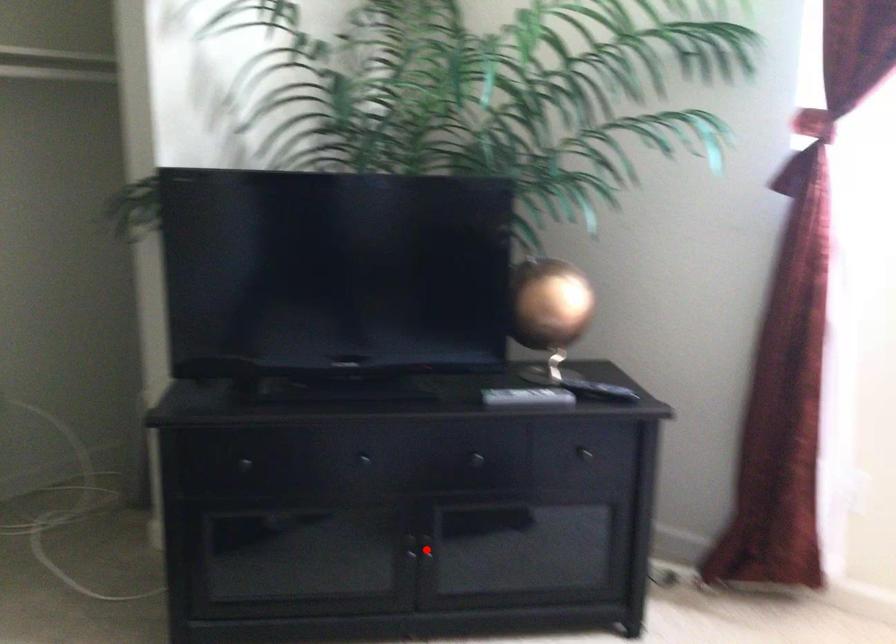
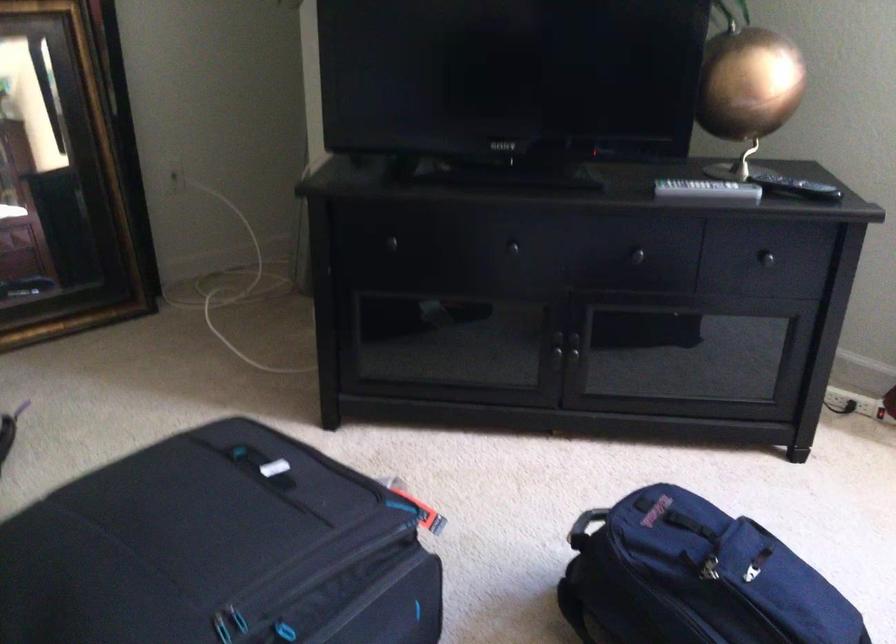
Locate, in the second image, the point that corresponds to the highlighted location in the first image.

(574, 351)